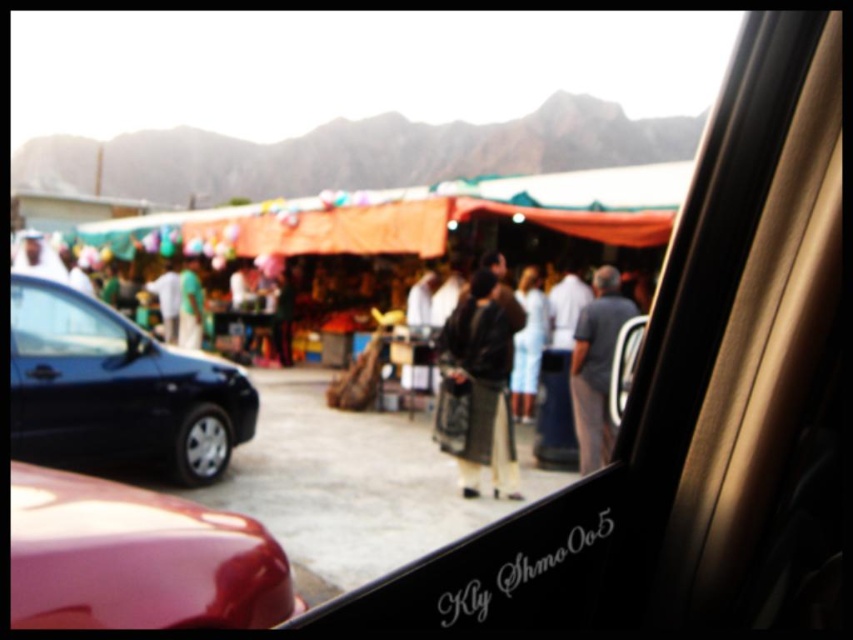
Question: In this image, where is gray cotton shirt at center located relative to green fabric bag at center?

Choices:
 (A) above
 (B) below

Answer: (B)

Question: Does glossy red car at lower left have a larger size compared to leather jacket at center?

Choices:
 (A) yes
 (B) no

Answer: (A)

Question: Among these objects, which one is nearest to the camera?

Choices:
 (A) glossy red car at lower left
 (B) black glossy car at left

Answer: (A)

Question: Which point is closer to the camera taking this photo?

Choices:
 (A) (202, 317)
 (B) (207, 387)
 (C) (585, 380)
 (D) (494, 323)

Answer: (D)

Question: Which of these objects is positioned farthest from the green fabric bag at center?

Choices:
 (A) glossy red car at lower left
 (B) leather jacket at center
 (C) black glossy car at left
 (D) gray cotton shirt at center

Answer: (A)

Question: Does black glossy car at left appear over leather jacket at center?

Choices:
 (A) yes
 (B) no

Answer: (B)